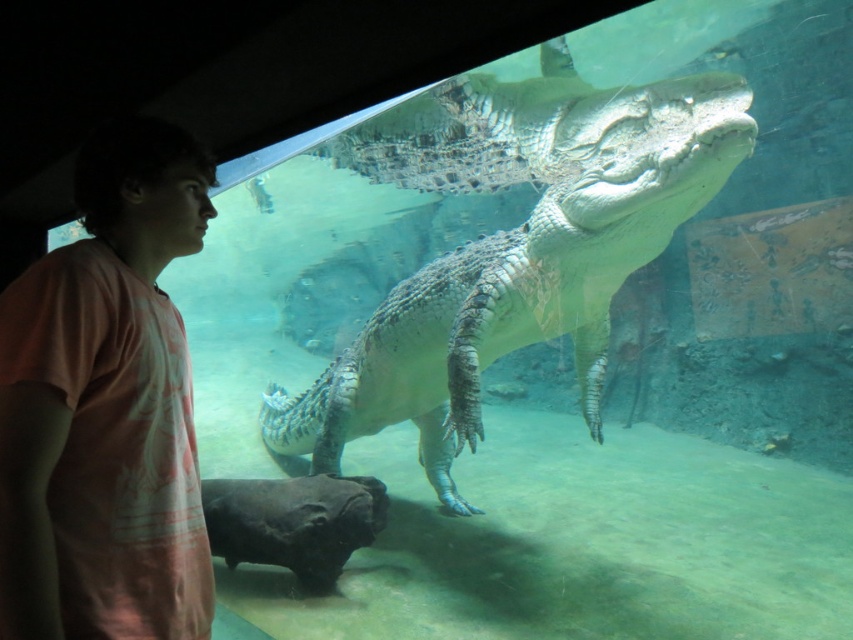
Question: Is gray textured crocodile at center smaller than pink cotton shirt at left?

Choices:
 (A) yes
 (B) no

Answer: (B)

Question: Which of the following is the closest to the observer?

Choices:
 (A) (453, 508)
 (B) (109, 276)

Answer: (B)

Question: Does gray textured crocodile at center have a smaller size compared to pink cotton shirt at left?

Choices:
 (A) yes
 (B) no

Answer: (B)

Question: Is gray textured crocodile at center wider than pink cotton shirt at left?

Choices:
 (A) no
 (B) yes

Answer: (B)

Question: Which point is closer to the camera?

Choices:
 (A) (138, 269)
 (B) (540, 291)

Answer: (A)